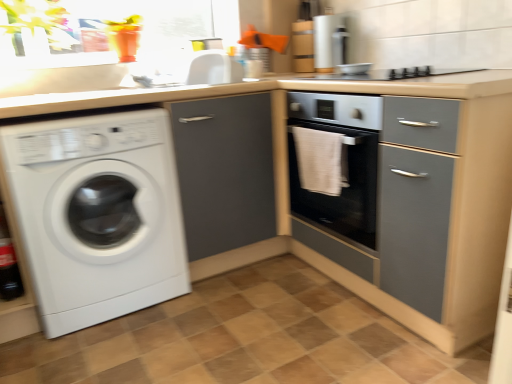
Question: Is matte gray cabinet at center located outside white glossy washing machine at left?

Choices:
 (A) no
 (B) yes

Answer: (B)

Question: Is matte gray cabinet at center shorter than white glossy washing machine at left?

Choices:
 (A) yes
 (B) no

Answer: (B)

Question: From a real-world perspective, is matte gray cabinet at center beneath white glossy washing machine at left?

Choices:
 (A) yes
 (B) no

Answer: (A)

Question: From a real-world perspective, is matte gray cabinet at center on white glossy washing machine at left?

Choices:
 (A) no
 (B) yes

Answer: (A)

Question: Is matte gray cabinet at center to the left of white glossy washing machine at left from the viewer's perspective?

Choices:
 (A) no
 (B) yes

Answer: (A)

Question: Is metallic silver bowl at upper center in front of or behind white glossy sink at upper center in the image?

Choices:
 (A) front
 (B) behind

Answer: (B)

Question: From the image's perspective, is metallic silver bowl at upper center located above or below white glossy sink at upper center?

Choices:
 (A) below
 (B) above

Answer: (A)

Question: Visually, is metallic silver bowl at upper center positioned to the left or to the right of white glossy sink at upper center?

Choices:
 (A) right
 (B) left

Answer: (A)

Question: Looking at their shapes, would you say metallic silver bowl at upper center is wider or thinner than white glossy sink at upper center?

Choices:
 (A) wide
 (B) thin

Answer: (B)

Question: From a real-world perspective, is white glossy sink at upper center positioned above or below white towel at center?

Choices:
 (A) below
 (B) above

Answer: (B)

Question: Considering the positions of point (179, 62) and point (331, 144), is point (179, 62) closer or farther from the camera than point (331, 144)?

Choices:
 (A) closer
 (B) farther

Answer: (B)

Question: From the image's perspective, relative to white towel at center, is white glossy sink at upper center above or below?

Choices:
 (A) below
 (B) above

Answer: (B)

Question: Based on their sizes in the image, would you say white glossy sink at upper center is bigger or smaller than white towel at center?

Choices:
 (A) big
 (B) small

Answer: (A)

Question: From the image's perspective, is matte gray cabinet at center above or below metallic silver bowl at upper center?

Choices:
 (A) above
 (B) below

Answer: (B)

Question: In terms of width, does matte gray cabinet at center look wider or thinner when compared to metallic silver bowl at upper center?

Choices:
 (A) thin
 (B) wide

Answer: (B)